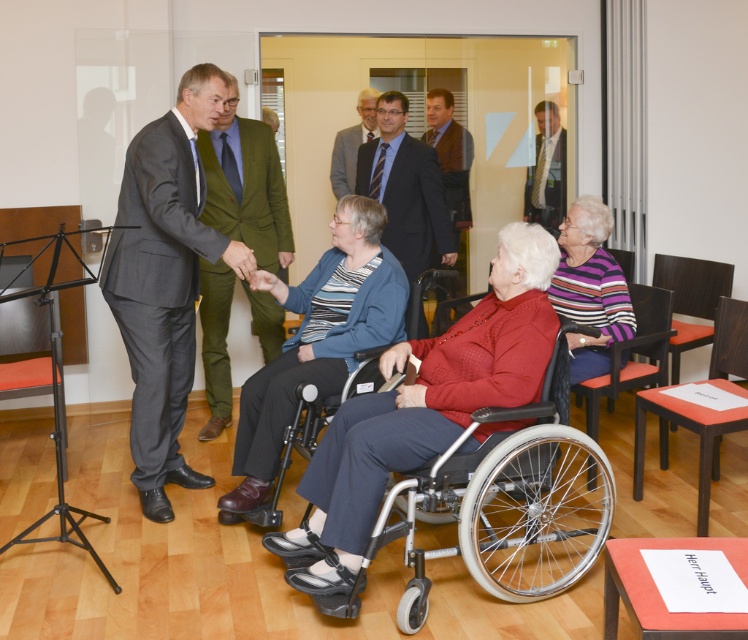
Is silver metallic wheelchair at center taller than orange wood chair at right?

Indeed, silver metallic wheelchair at center has a greater height compared to orange wood chair at right.

Is point (548, 493) closer to camera compared to point (702, 465)?

Yes, it is.

Based on the photo, who is more forward, (426, 611) or (723, 321)?

Point (426, 611) is more forward.

I want to click on silver metallic wheelchair at center, so click(x=500, y=506).

Based on the photo, between brown leather jacket at center and brown textured suit at center, which one is positioned higher?

brown textured suit at center is higher up.

Looking at this image, can you confirm if brown leather jacket at center is shorter than brown textured suit at center?

Incorrect, brown leather jacket at center's height does not fall short of brown textured suit at center's.

Does point (438, 300) lie behind point (453, 200)?

Yes, it is behind point (453, 200).

This screenshot has height=640, width=748. Identify the location of brown leather jacket at center. (450, 150).

Who is positioned more to the left, dark gray suit at center or orange fabric chair at right?

From the viewer's perspective, dark gray suit at center appears more on the left side.

Can you confirm if dark gray suit at center is positioned to the right of orange fabric chair at right?

No, dark gray suit at center is not to the right of orange fabric chair at right.

Find the location of a particular element. This screenshot has width=748, height=640. dark gray suit at center is located at coordinates (165, 280).